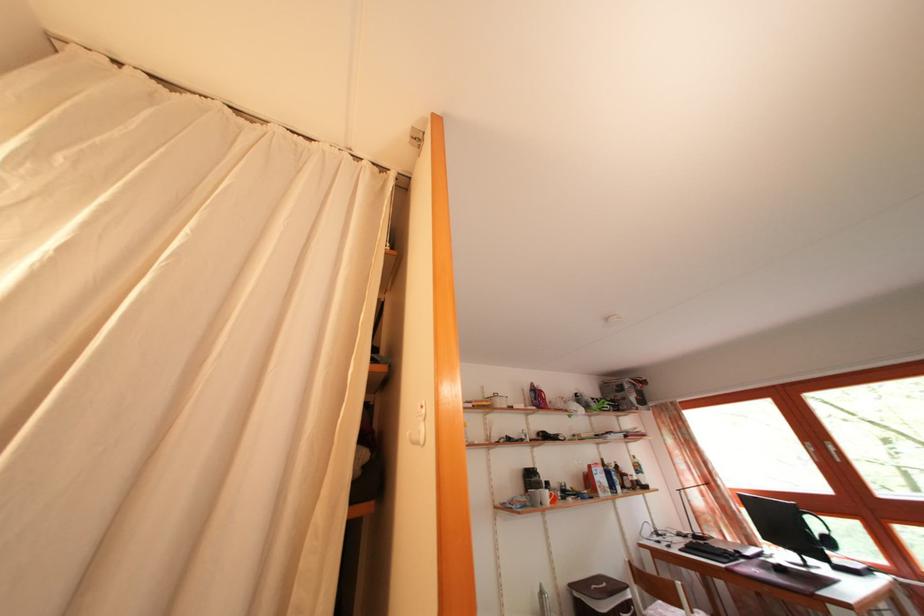
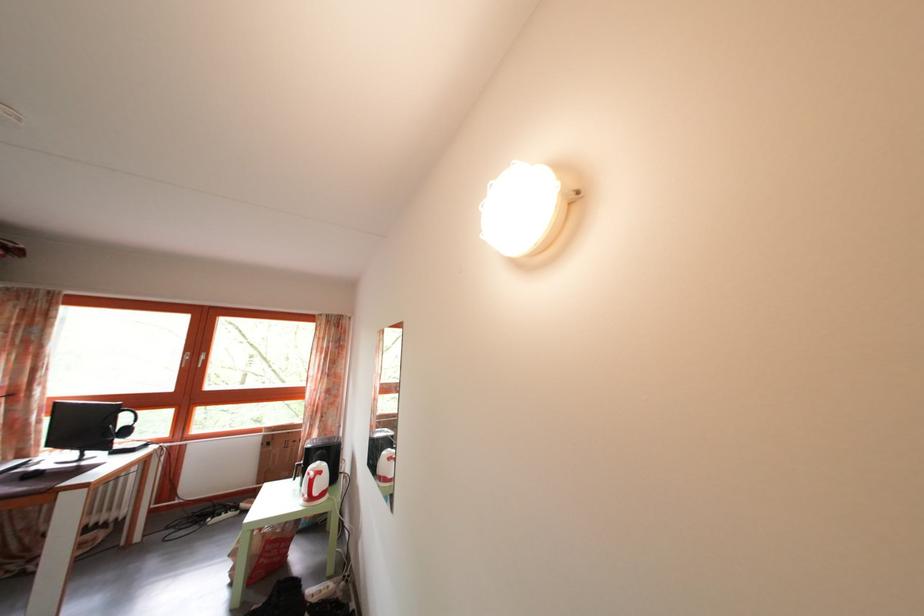
Find the pixel in the second image that matches the point at 842,564 in the first image.

(128, 451)